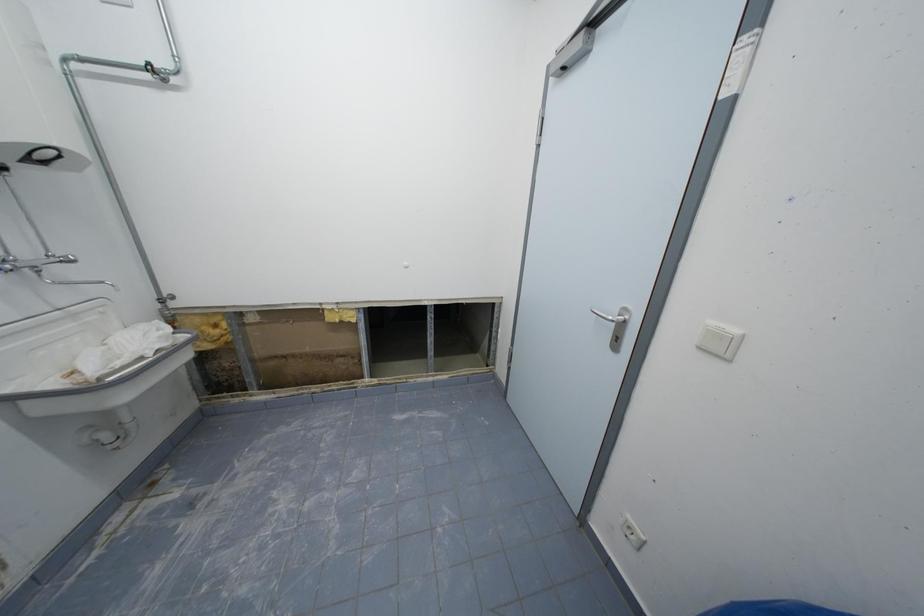
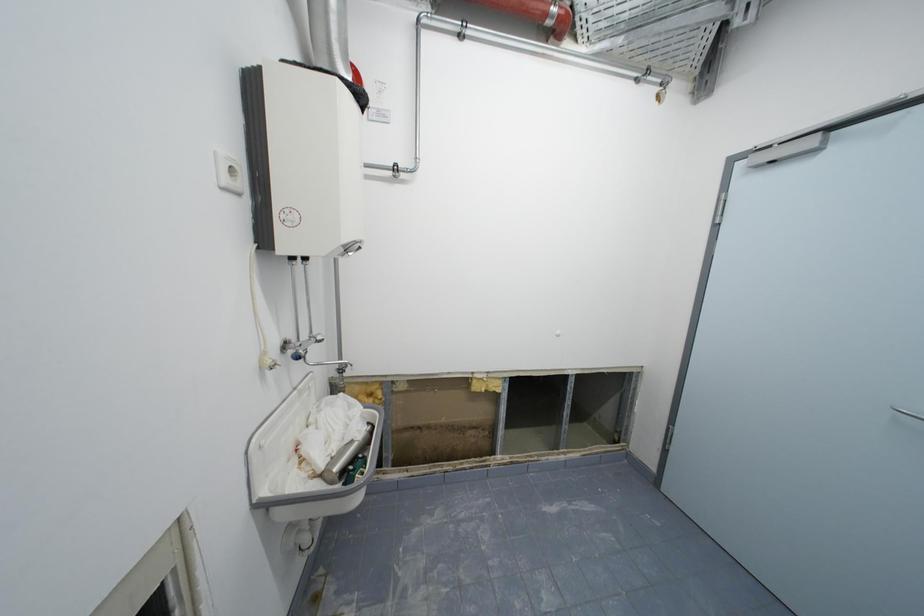
Question: What movement of the cameraman would produce the second image?

Choices:
 (A) Left
 (B) Right
 (C) Forward
 (D) Backward

Answer: (A)